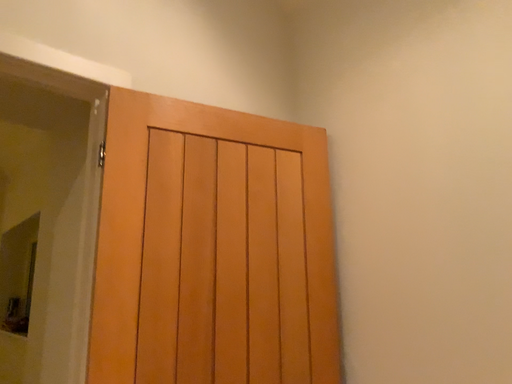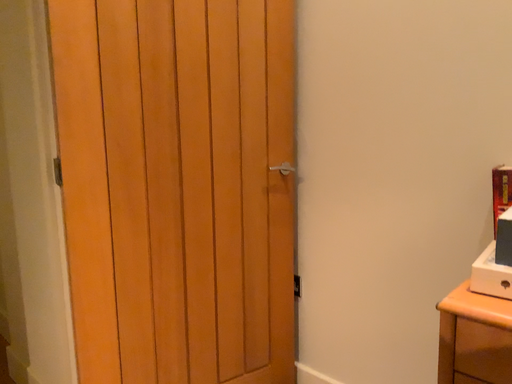
Question: Which way did the camera rotate in the video?

Choices:
 (A) rotated downward
 (B) rotated upward

Answer: (A)